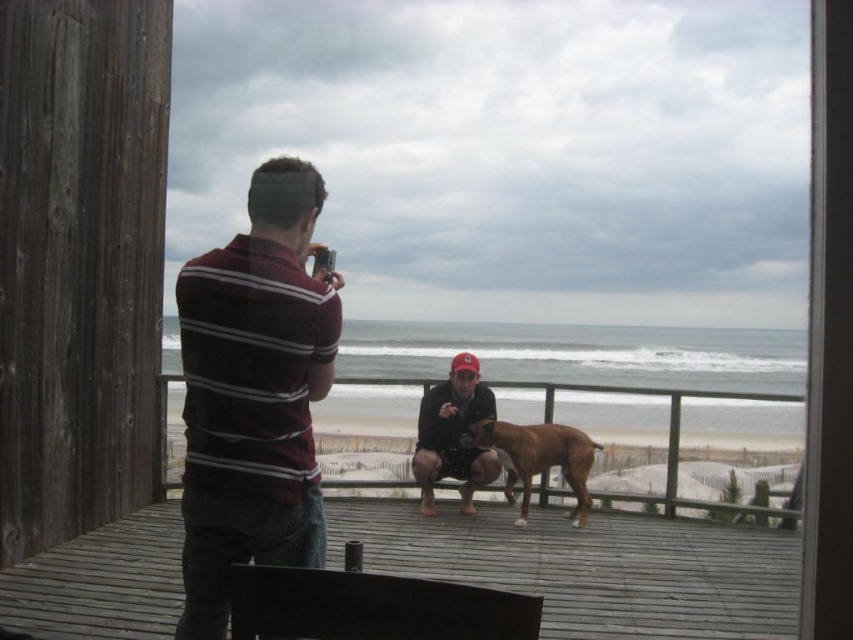
You are standing on the wooden deck at center and want to take a photo of the beach. The camera is 5.65 meters away from you. Can you reach the camera without leaving the deck?

The camera is 5.65 meters away from the wooden deck at center. Since the camera is outside the deck, you would need to step off the deck to reach it.

You are standing inside the wooden structure and want to take a photo of both the maroon striped shirt at left and the matte black jacket at center. Which direction should you move to ensure both are in your camera frame?

You should move to the right side of the wooden structure to ensure both the maroon striped shirt at left and the matte black jacket at center are in your camera frame since the maroon striped shirt at left is positioned to the left of the matte black jacket at center.